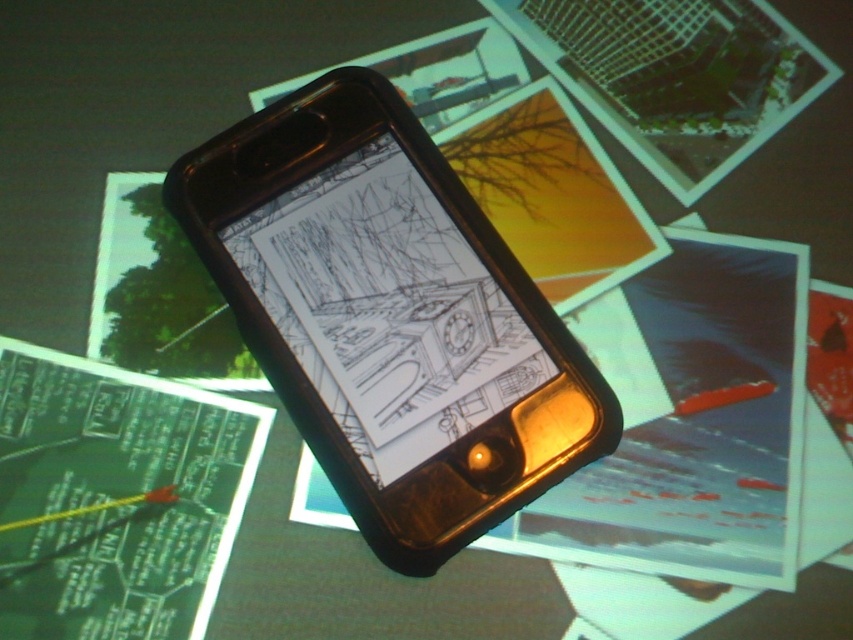
Question: Among these points, which one is nearest to the camera?

Choices:
 (A) [701, 433]
 (B) [370, 125]
 (C) [241, 497]

Answer: (C)

Question: Which of these objects is positioned farthest from the matte yellow paper at center?

Choices:
 (A) green paper at center
 (B) black plastic smartphone at center

Answer: (A)

Question: Can you confirm if black plastic smartphone at center is thinner than matte yellow paper at center?

Choices:
 (A) no
 (B) yes

Answer: (A)

Question: Among these objects, which one is nearest to the camera?

Choices:
 (A) green paper at center
 (B) matte yellow paper at center
 (C) black plastic smartphone at center

Answer: (A)

Question: Is matte yellow paper at center positioned at the back of green paper at center?

Choices:
 (A) no
 (B) yes

Answer: (B)

Question: Can you confirm if matte yellow paper at center is smaller than green paper at center?

Choices:
 (A) yes
 (B) no

Answer: (B)